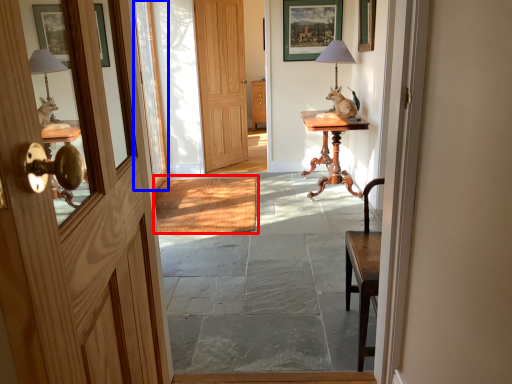
Question: Which of the following is the farthest to the observer, doormat (highlighted by a red box) or glass door (highlighted by a blue box)?

Choices:
 (A) doormat
 (B) glass door

Answer: (B)